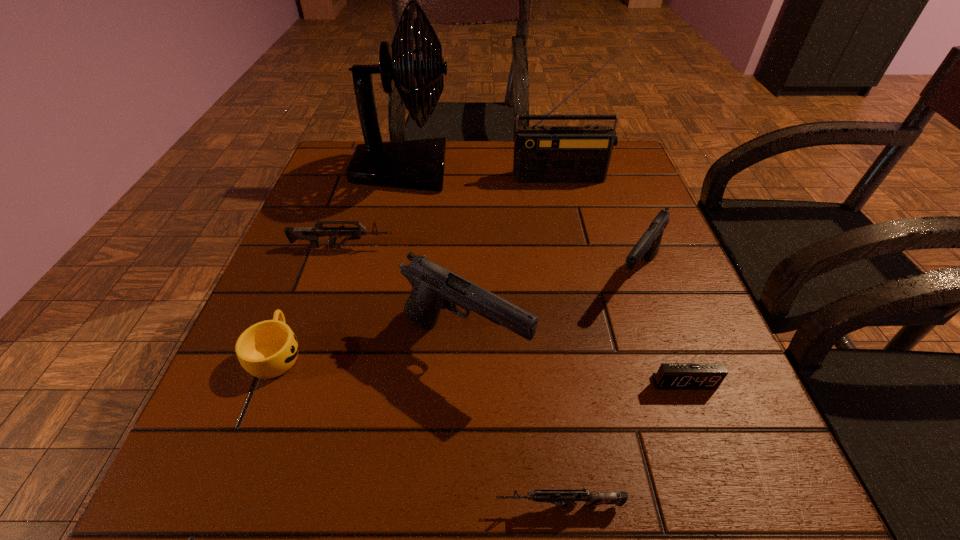
Image resolution: width=960 pixels, height=540 pixels. I want to click on vacant space in between the fourth tallest object and the bigger black gun, so click(x=550, y=310).

The width and height of the screenshot is (960, 540). Identify the location of free spot between the smaller black gun and the alarm clock. (660, 329).

What are the coordinates of `free space between the farther black gun and the right grey gun` in the screenshot? It's located at pyautogui.click(x=598, y=390).

At what (x,y) coordinates should I click in order to perform the action: click on free spot between the bigger black gun and the radio receiver. Please return your answer as a coordinate pair (x, y). This screenshot has width=960, height=540. Looking at the image, I should click on (515, 261).

Where is `vacant point located between the fan and the beige cup`? The height and width of the screenshot is (540, 960). vacant point located between the fan and the beige cup is located at coordinates (340, 261).

Locate an element on the screen. empty location between the beige cup and the leftmost gun is located at coordinates (310, 300).

Find the location of a particular element. free point between the cup and the fan is located at coordinates (340, 261).

What are the coordinates of `empty space that is in between the alarm clock and the third shortest gun` in the screenshot? It's located at (660, 329).

Find the location of a particular element. free space that is in between the nearest gun and the fifth tallest object is located at coordinates (450, 376).

Identify the location of the seventh closest object to the cup. (542, 154).